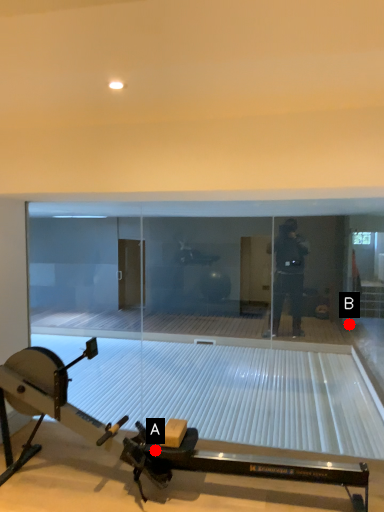
Question: Two points are circled on the image, labeled by A and B beside each circle. Which point is farther from the camera taking this photo?

Choices:
 (A) A is further
 (B) B is further

Answer: (B)